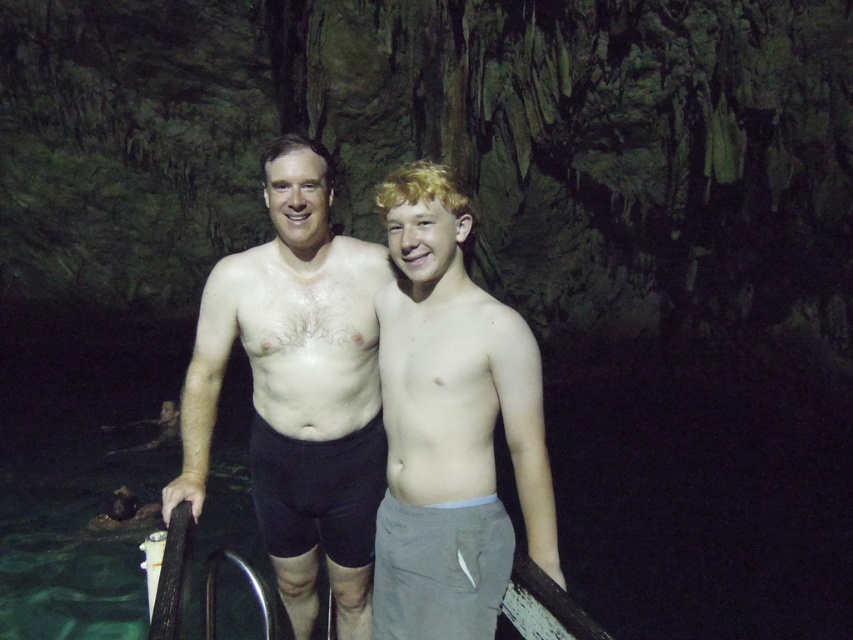
Can you confirm if smooth skin torso at center is thinner than light brown cotton shorts at center?

No, smooth skin torso at center is not thinner than light brown cotton shorts at center.

Who is taller, smooth skin torso at center or light brown cotton shorts at center?

Standing taller between the two is smooth skin torso at center.

Does point (296, 284) come in front of point (514, 371)?

That is False.

Where is `smooth skin torso at center`? This screenshot has height=640, width=853. smooth skin torso at center is located at coordinates (299, 388).